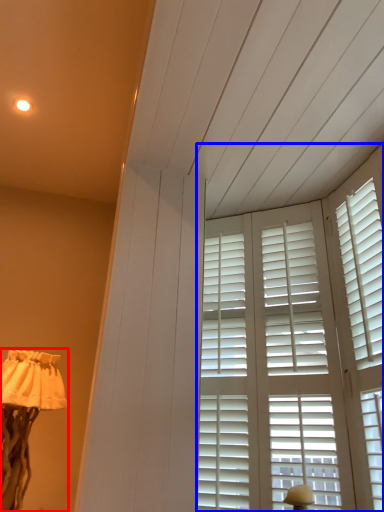
Question: Which of the following is the closest to the observer, lamp (highlighted by a red box) or window (highlighted by a blue box)?

Choices:
 (A) lamp
 (B) window

Answer: (B)